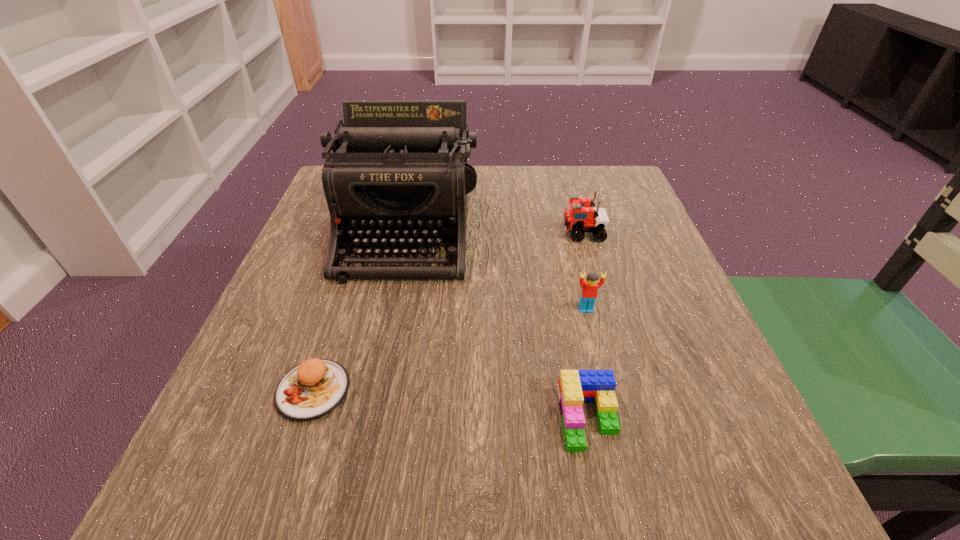
Locate an element on the screen. This screenshot has height=540, width=960. free space at the left edge of the desktop is located at coordinates (251, 428).

Locate an element on the screen. The image size is (960, 540). free region at the right edge of the desktop is located at coordinates (x=625, y=242).

Find the location of a particular element. The image size is (960, 540). vacant area at the near left corner of the desktop is located at coordinates (238, 480).

Locate an element on the screen. The width and height of the screenshot is (960, 540). free space between the farthest Lego and the second nearest Lego is located at coordinates (584, 271).

You are a GUI agent. You are given a task and a screenshot of the screen. Output one action in this format:
    pyautogui.click(x=<x>, y=<y>)
    Task: Click on the free point between the farthest Lego and the third farthest object
    The height and width of the screenshot is (540, 960).
    Given the screenshot: What is the action you would take?
    pyautogui.click(x=584, y=271)

Locate an element on the screen. The image size is (960, 540). empty space that is in between the patty and the shortest Lego is located at coordinates (450, 404).

The image size is (960, 540). I want to click on vacant area between the patty and the nearest Lego, so pyautogui.click(x=450, y=404).

This screenshot has width=960, height=540. What are the coordinates of `free space between the nearest Lego and the tallest object` in the screenshot? It's located at (497, 323).

Locate an element on the screen. The height and width of the screenshot is (540, 960). free space between the third nearest object and the patty is located at coordinates (449, 350).

Identify the location of vacant area that lies between the patty and the third nearest object. (449, 350).